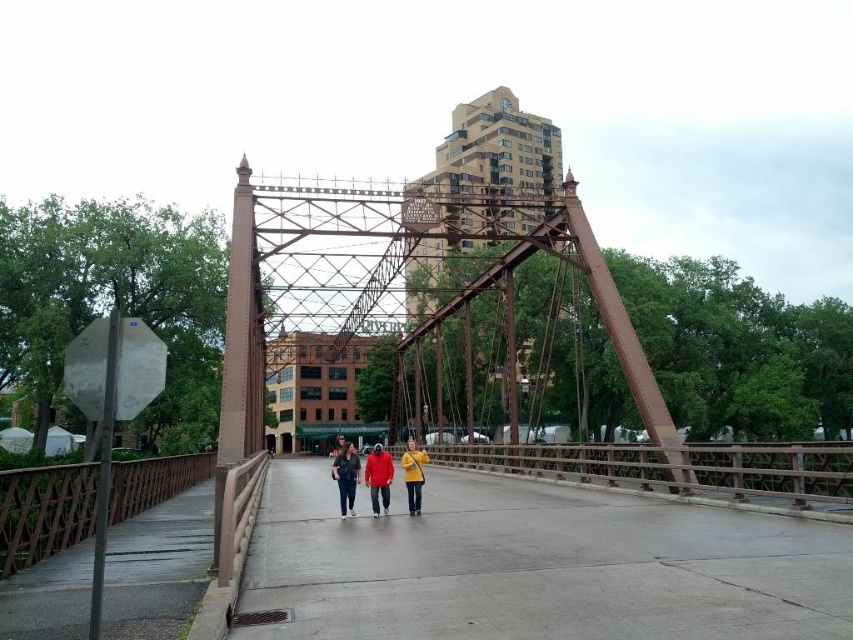
Question: Considering the relative positions of matte red jacket at center and matte yellow jacket at center in the image provided, where is matte red jacket at center located with respect to matte yellow jacket at center?

Choices:
 (A) left
 (B) right

Answer: (A)

Question: Which object appears farthest from the camera in this image?

Choices:
 (A) gray concrete pavement at center
 (B) matte red jacket at center

Answer: (B)

Question: Which of the following is the farthest from the observer?

Choices:
 (A) gray concrete pavement at center
 (B) matte red jacket at center
 (C) red matte jacket at center

Answer: (C)

Question: Does denim jacket at center have a larger size compared to matte yellow jacket at center?

Choices:
 (A) yes
 (B) no

Answer: (A)

Question: Does gray concrete pavement at center have a larger size compared to denim jacket at center?

Choices:
 (A) yes
 (B) no

Answer: (B)

Question: Among these points, which one is nearest to the camera?

Choices:
 (A) (381, 554)
 (B) (334, 460)
 (C) (343, 499)
 (D) (412, 468)

Answer: (A)